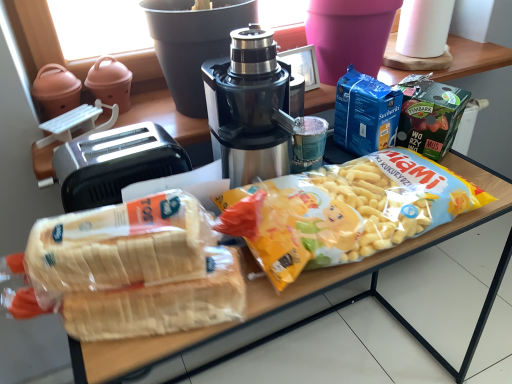
At what (x,y) coordinates should I click in order to perform the action: click on translucent plastic bag of bread at center. Please return your answer as a coordinate pair (x, y). The height and width of the screenshot is (384, 512). Looking at the image, I should click on (402, 258).

Image resolution: width=512 pixels, height=384 pixels. What do you see at coordinates (121, 245) in the screenshot? I see `translucent plastic bread at lower left` at bounding box center [121, 245].

In order to face translucent plastic bread at lower left, should I rotate leftwards or rightwards?

Rotate your view left by about 14.159°.

The width and height of the screenshot is (512, 384). In order to click on translucent plastic bag of bread at center in this screenshot , I will do `click(402, 258)`.

Based on the photo, based on their sizes in the image, would you say black plastic toaster at left is bigger or smaller than translucent plastic bread at lower left?

Considering their sizes, black plastic toaster at left takes up more space than translucent plastic bread at lower left.

Are black plastic toaster at left and translucent plastic bread at lower left located far from each other?

No.

From the picture: Choose the correct answer: Is black plastic toaster at left inside translucent plastic bread at lower left or outside it?

black plastic toaster at left is not enclosed by translucent plastic bread at lower left.

Considering the relative sizes of black plastic toaster at left and translucent plastic bread at lower left in the image provided, is black plastic toaster at left wider than translucent plastic bread at lower left?

Yes, black plastic toaster at left is wider than translucent plastic bread at lower left.

Which is more distant, [256,121] or [115,221]?

The point [256,121] is more distant.

Would you consider stainless steel coffee maker at center to be distant from translucent plastic bread at lower left?

Actually, stainless steel coffee maker at center and translucent plastic bread at lower left are a little close together.

In the scene shown: Can you tell me how much stainless steel coffee maker at center and translucent plastic bread at lower left differ in facing direction?

stainless steel coffee maker at center and translucent plastic bread at lower left are facing 17.4 degrees away from each other.

How far apart are stainless steel coffee maker at center and translucent plastic bread at lower left?

10.75 inches.

Is translucent plastic bag of bread at center positioned beyond the bounds of white paper towel at upper right?

Yes, translucent plastic bag of bread at center is located beyond the bounds of white paper towel at upper right.

From the image's perspective, is translucent plastic bag of bread at center on top of white paper towel at upper right?

Actually, translucent plastic bag of bread at center appears below white paper towel at upper right in the image.

Can you confirm if translucent plastic bag of bread at center is taller than white paper towel at upper right?

Yes.

Based on the photo, which object is closer to the camera taking this photo, translucent plastic bag of bread at center or white paper towel at upper right?

translucent plastic bag of bread at center is in front.

From a real-world perspective, who is located higher, stainless steel coffee maker at center or black plastic toaster at left?

In real-world perspective, stainless steel coffee maker at center is above.

Does point (270, 78) appear closer or farther from the camera than point (73, 169)?

Clearly, point (270, 78) is more distant from the camera than point (73, 169).

Which object is wider, stainless steel coffee maker at center or black plastic toaster at left?

stainless steel coffee maker at center is wider.

The image size is (512, 384). I want to click on table below the white paper towel at upper right (from a real-world perspective), so click(402, 258).

Considering the points (397, 36) and (174, 336), which point is in front, point (397, 36) or point (174, 336)?

Positioned in front is point (174, 336).

Is white paper towel at upper right not inside translucent plastic bag of bread at center?

white paper towel at upper right lies outside translucent plastic bag of bread at center's area.

From the image's perspective, relative to translucent plastic bag of bread at center, is white paper towel at upper right above or below?

white paper towel at upper right is above translucent plastic bag of bread at center.

Is stainless steel coffee maker at center oriented away from white paper towel at upper right?

No.

From a real-world perspective, which object stands above the other?

white paper towel at upper right.

Does point (284, 122) come behind point (422, 56)?

That is False.

This screenshot has width=512, height=384. Find the location of `paper towel that is above the stainless steel coffee maker at center (from a real-world perspective)`. paper towel that is above the stainless steel coffee maker at center (from a real-world perspective) is located at coordinates (424, 28).

Is white paper towel at upper right at the back of black plastic toaster at left?

No, black plastic toaster at left is not facing away from white paper towel at upper right.

Is black plastic toaster at left far from white paper towel at upper right?

Actually, black plastic toaster at left and white paper towel at upper right are a little close together.

The image size is (512, 384). I want to click on toaster below the white paper towel at upper right (from a real-world perspective), so click(x=115, y=164).

Who is bigger, black plastic toaster at left or white paper towel at upper right?

With larger size is black plastic toaster at left.

Find the location of a particular element. snack below the black plastic toaster at left (from the image's perspective) is located at coordinates (121, 245).

Find the location of a particular element. Image resolution: width=512 pixels, height=384 pixels. coffee maker on the right of translucent plastic bread at lower left is located at coordinates point(250,107).

Considering their positions, is translucent plastic bag of bread at center positioned further to translucent plastic bread at lower left than black plastic toaster at left?

Based on the image, translucent plastic bag of bread at center appears to be further to translucent plastic bread at lower left.

Looking at the image, which one is located closer to translucent plastic bread at lower left, stainless steel coffee maker at center or translucent plastic bag of bread at center?

stainless steel coffee maker at center is positioned closer to the anchor translucent plastic bread at lower left.

Based on their spatial positions, is white paper towel at upper right or stainless steel coffee maker at center closer to translucent plastic bag of bread at center?

stainless steel coffee maker at center is positioned closer to the anchor translucent plastic bag of bread at center.

From the image, which object appears to be nearer to black plastic toaster at left, translucent plastic bag of bread at center or stainless steel coffee maker at center?

stainless steel coffee maker at center.

Based on their spatial positions, is translucent plastic bag of bread at center or stainless steel coffee maker at center further from translucent plastic bread at lower left?

Among the two, translucent plastic bag of bread at center is located further to translucent plastic bread at lower left.

Considering their positions, is translucent plastic bread at lower left positioned further to translucent plastic bag of bread at center than white paper towel at upper right?

white paper towel at upper right is positioned further to the anchor translucent plastic bag of bread at center.

Considering their positions, is stainless steel coffee maker at center positioned further to translucent plastic bag of bread at center than translucent plastic bread at lower left?

stainless steel coffee maker at center lies further to translucent plastic bag of bread at center than the other object.

Which object lies nearer to the anchor point black plastic toaster at left, white paper towel at upper right or translucent plastic bag of bread at center?

The object closer to black plastic toaster at left is translucent plastic bag of bread at center.

What are the coordinates of `snack between black plastic toaster at left and stainless steel coffee maker at center` in the screenshot? It's located at (121, 245).

Find the location of a particular element. The width and height of the screenshot is (512, 384). snack between black plastic toaster at left and translucent plastic bag of bread at center from left to right is located at coordinates (121, 245).

The image size is (512, 384). In order to click on snack between stainless steel coffee maker at center and translucent plastic bag of bread at center vertically in this screenshot , I will do `click(121, 245)`.

Locate an element on the screen. Image resolution: width=512 pixels, height=384 pixels. coffee maker between white paper towel at upper right and translucent plastic bag of bread at center in the up-down direction is located at coordinates (250, 107).